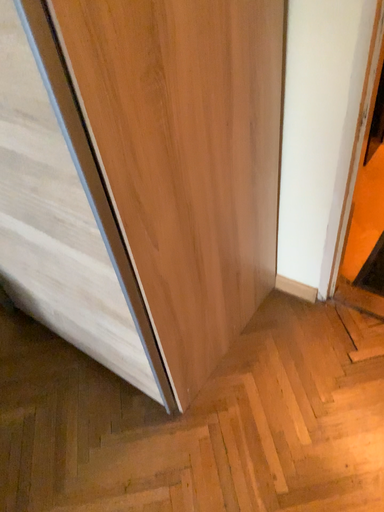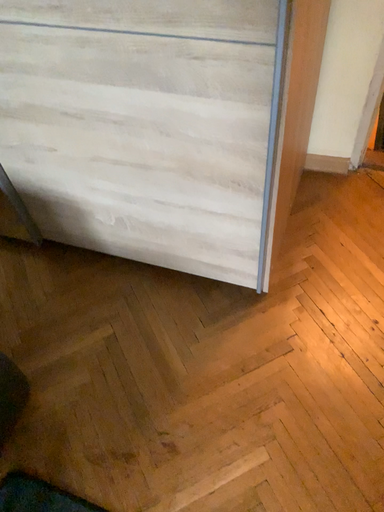
Question: Which way did the camera rotate in the video?

Choices:
 (A) rotated right
 (B) rotated left

Answer: (A)